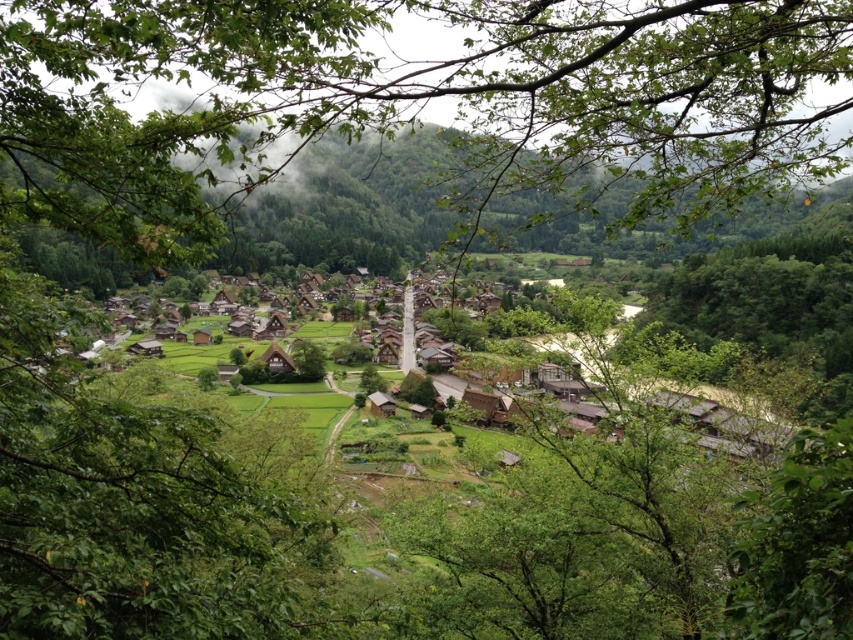
You are standing in the village and want to walk from the point at coordinates point (286, 353) to the point at coordinates point (376, 397). Which direction should you move relative to your current position?

You should move away from yourself because point (286, 353) is closer to you than point (376, 397).

You are standing in the middle of the village and see both the wooden thatched hut at center and the wooden hut at center. Which one is closer to you?

The wooden thatched hut at center is closer to you because it is further to the viewer than the wooden hut at center.

You are a tourist visiting the village and want to take a photo of both the wooden thatched hut at center and the wooden hut at center. Which one should you stand closer to in order to capture both in a single frame?

The wooden thatched hut at center might be wider than wooden hut at center, so you should stand closer to the wooden thatched hut at center to ensure both are visible in the frame.